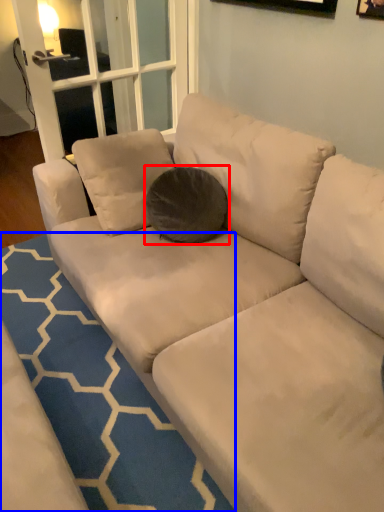
Question: Which of the following is the closest to the observer, throw pillow (highlighted by a red box) or doormat (highlighted by a blue box)?

Choices:
 (A) throw pillow
 (B) doormat

Answer: (B)